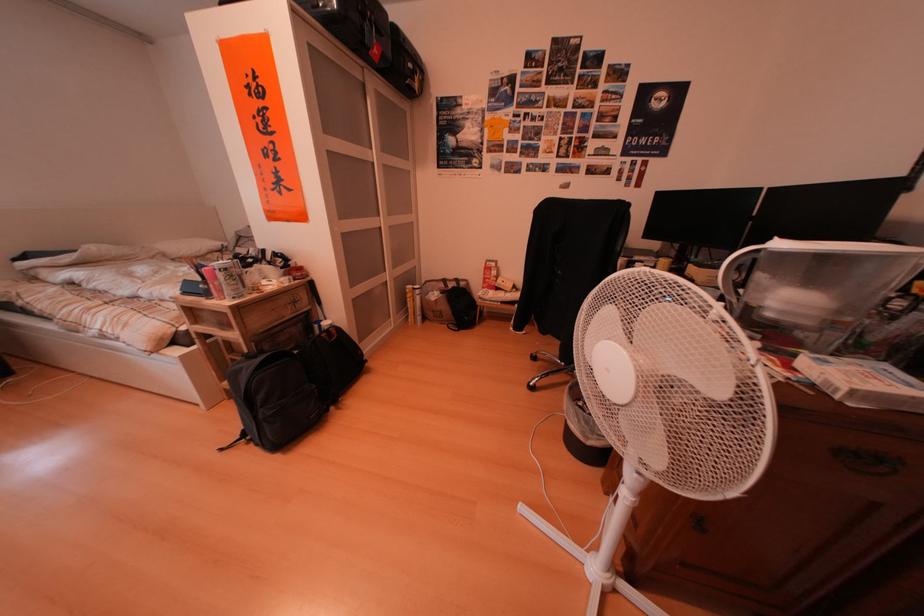
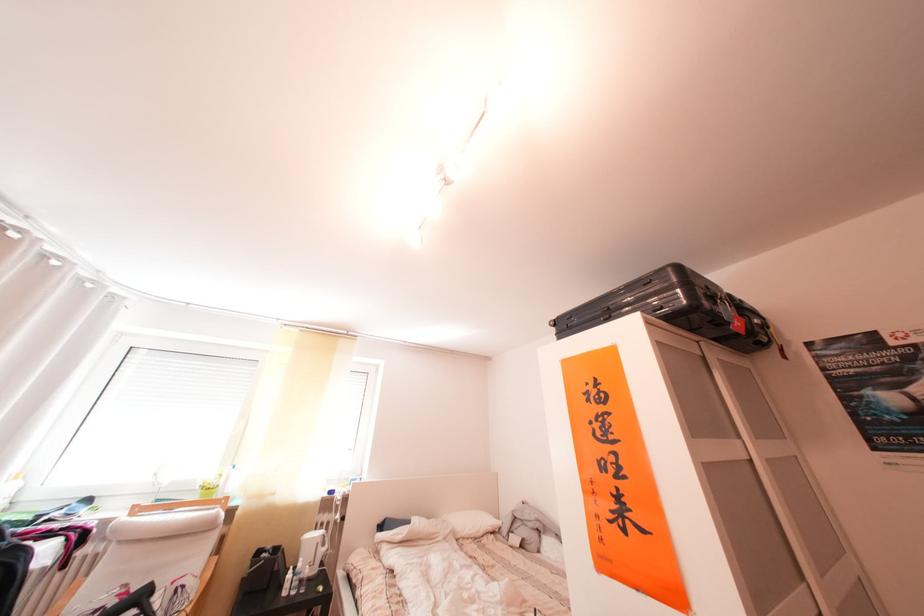
The point at (227, 254) is marked in the first image. Where is the corresponding point in the second image?

(504, 535)